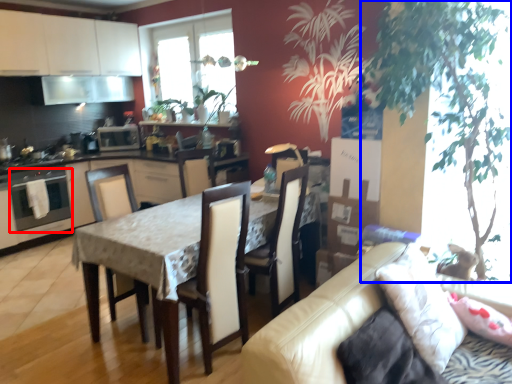
Question: Which object is further to the camera taking this photo, oven (highlighted by a red box) or plant (highlighted by a blue box)?

Choices:
 (A) oven
 (B) plant

Answer: (A)